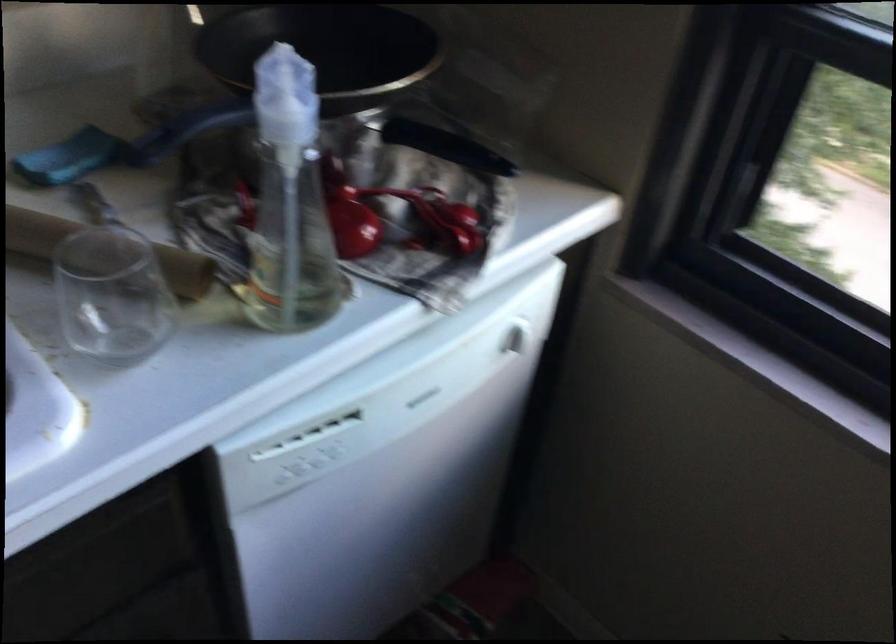
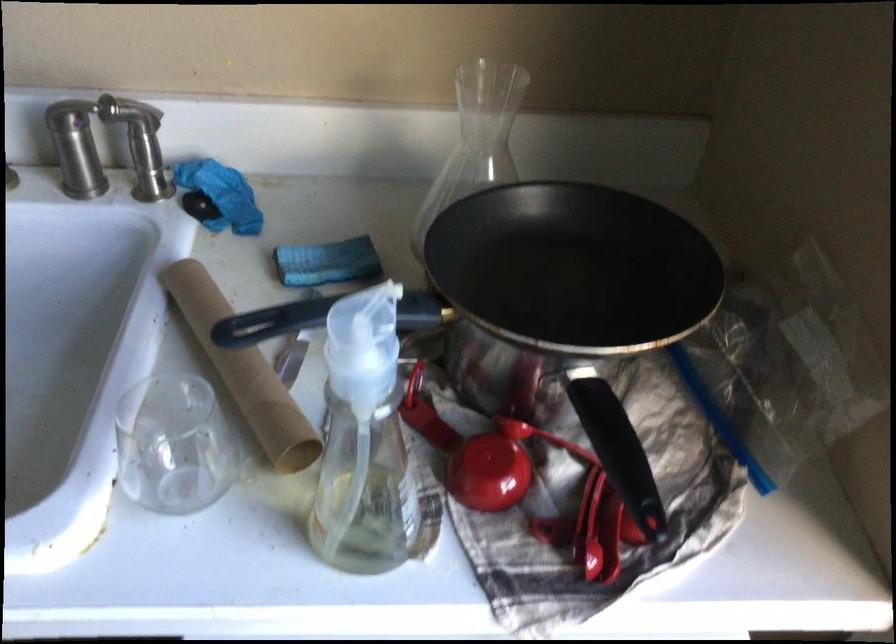
In the second image, find the point that corresponds to pixel 453 138 in the first image.

(618, 451)